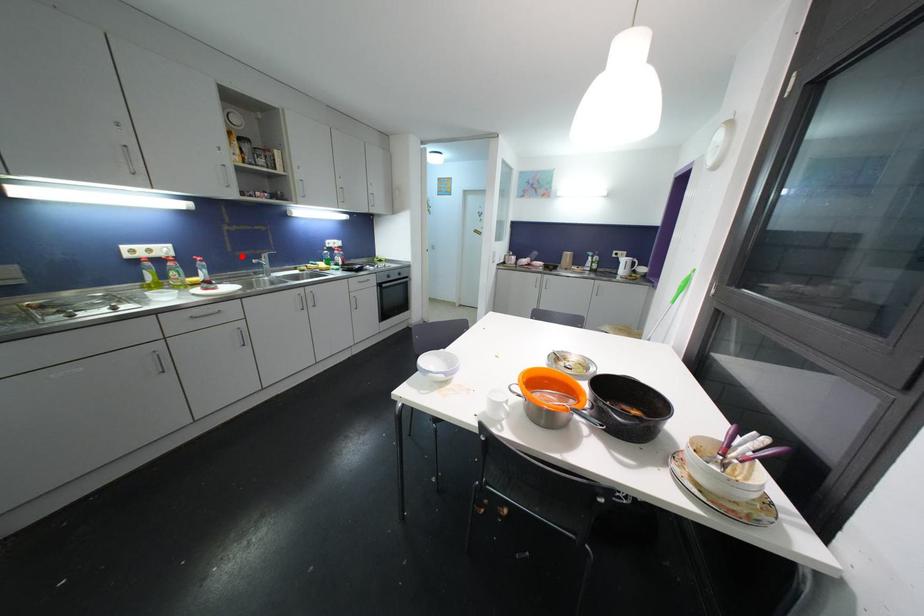
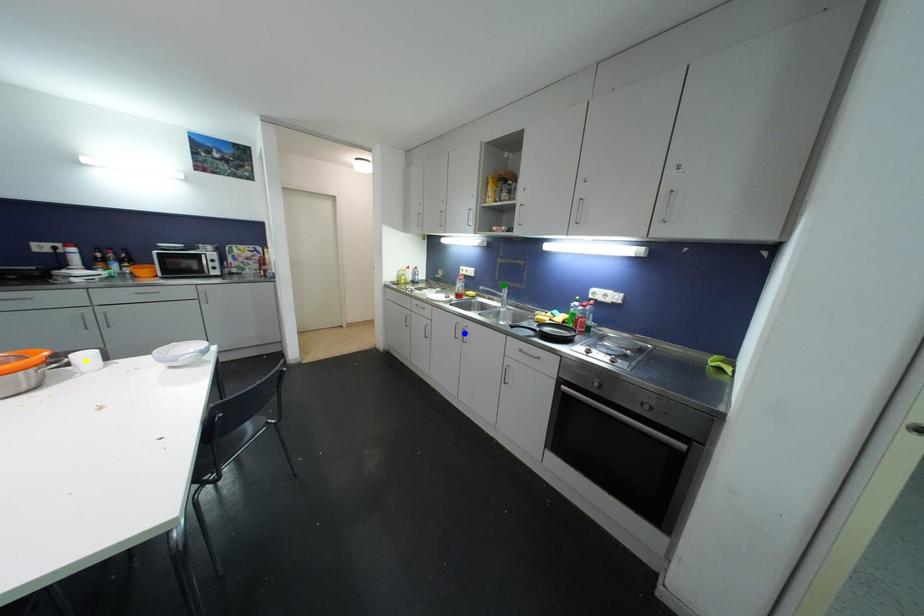
Question: I am providing you with two images of the same scene from different viewpoints. A red point is marked on the first image. You are given multiple points on the second image. Which point in image 2 is actually the same real-world point as the red point in image 1?

Choices:
 (A) green point
 (B) yellow point
 (C) blue point

Answer: (A)